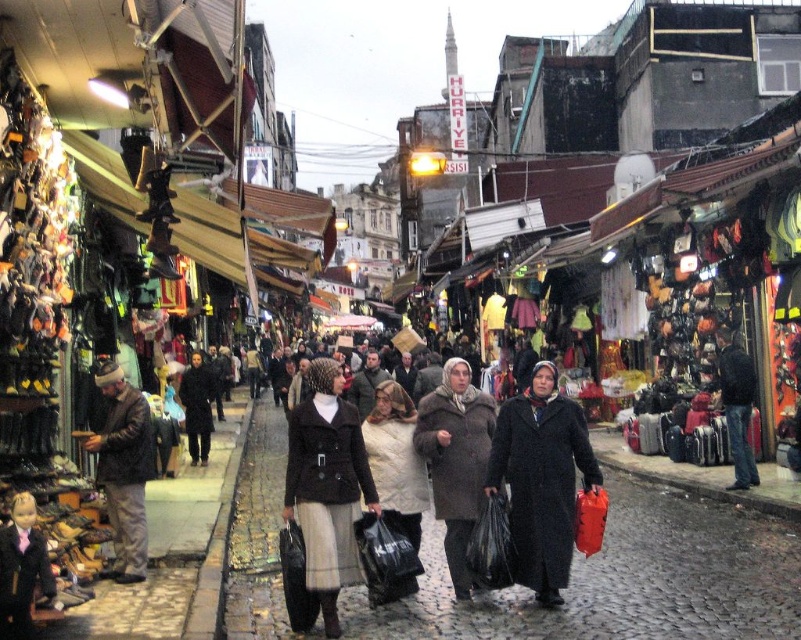
Is the position of smooth black coat at lower left more distant than that of dark brown coat at center?

No, it is not.

Find the location of a particular element. The height and width of the screenshot is (640, 801). smooth black coat at lower left is located at coordinates (22, 570).

In the scene shown: Is black matte coat at center below dark brown leather jacket at left?

Yes.

The height and width of the screenshot is (640, 801). Identify the location of black matte coat at center. (541, 480).

Find the location of a particular element. The width and height of the screenshot is (801, 640). black matte coat at center is located at coordinates (541, 480).

Can you confirm if dark blue leather jacket at right is wider than dark brown coat at center?

Incorrect, dark blue leather jacket at right's width does not surpass dark brown coat at center's.

Is dark blue leather jacket at right above dark brown coat at center?

Yes.

I want to click on dark blue leather jacket at right, so click(x=735, y=404).